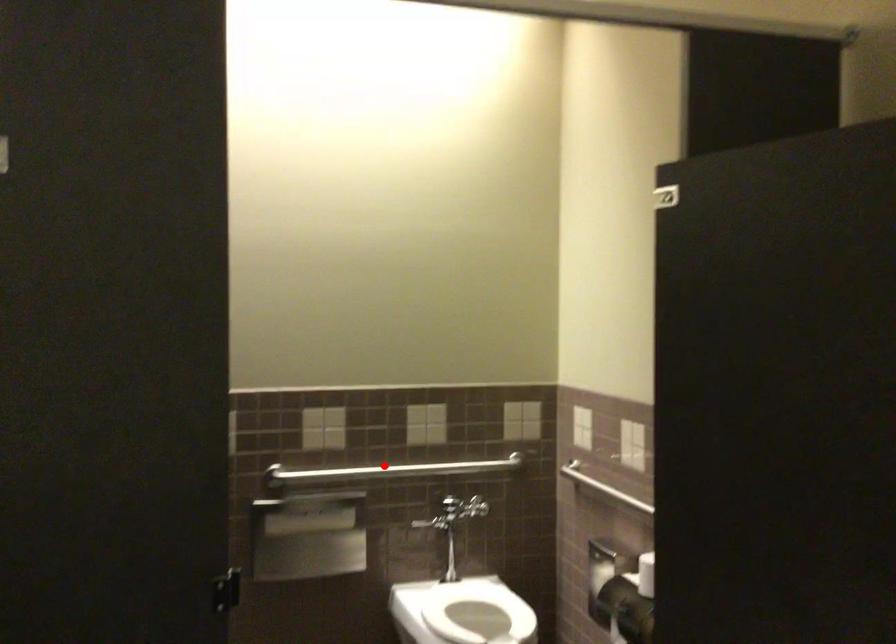
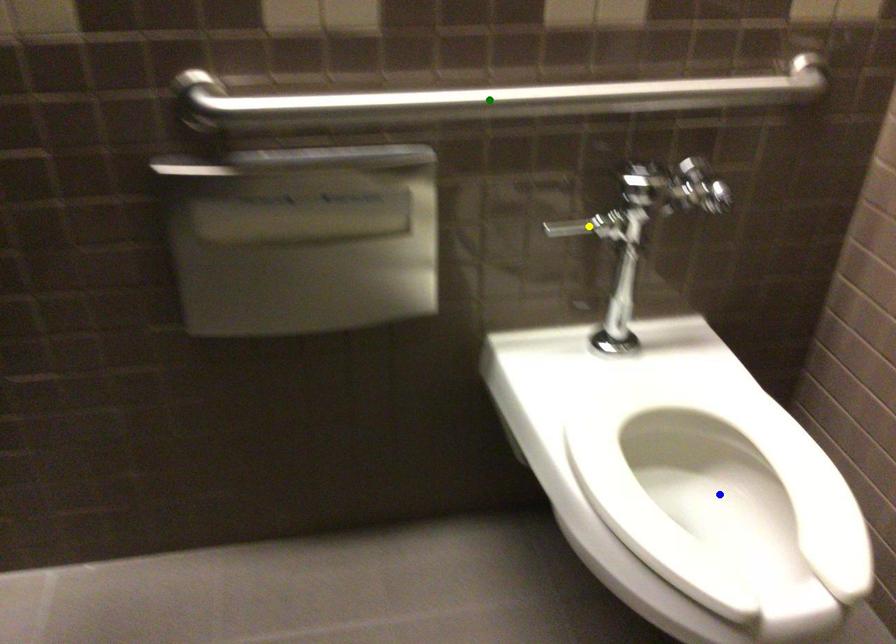
Question: I am providing you with two images of the same scene from different viewpoints. A red point is marked on the first image. You are given multiple points on the second image. Can you choose the point in image 2 that corresponds to the point in image 1?

Choices:
 (A) blue point
 (B) yellow point
 (C) green point

Answer: (C)